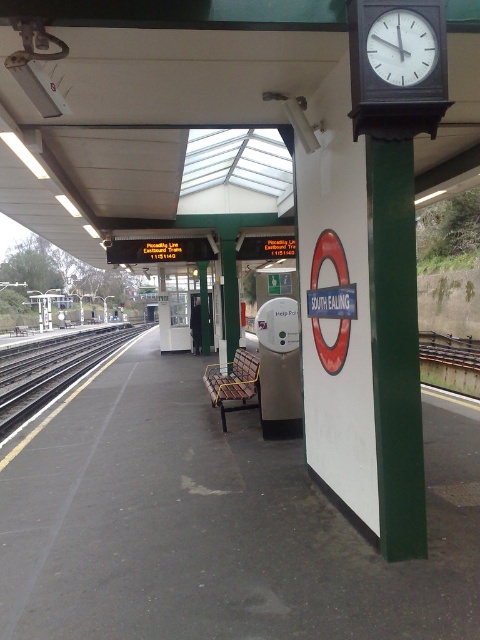
Between point (414, 356) and point (43, 371), which one is positioned behind?

The point (43, 371) is behind.

This screenshot has height=640, width=480. What do you see at coordinates (395, 348) in the screenshot?
I see `green polished pole at right` at bounding box center [395, 348].

Where is `green polished pole at right`? green polished pole at right is located at coordinates (395, 348).

Does concrete platform at center have a lesser height compared to black metal track at left?

Correct, concrete platform at center is not as tall as black metal track at left.

The height and width of the screenshot is (640, 480). I want to click on concrete platform at center, so click(x=216, y=524).

Does point (2, 634) come in front of point (407, 20)?

Yes, it is in front of point (407, 20).

Is point (101, 493) positioned before point (420, 42)?

No.

Find the location of a particular element. concrete platform at center is located at coordinates (216, 524).